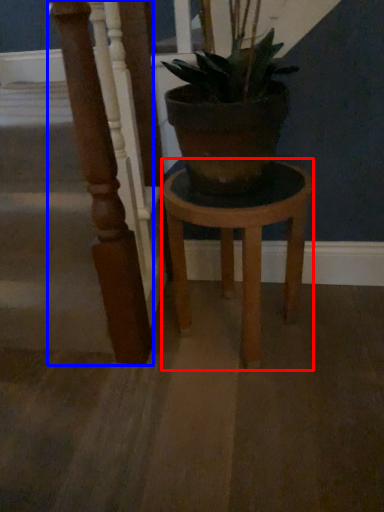
Question: Which point is closer to the camera, stool (highlighted by a red box) or pillar (highlighted by a blue box)?

Choices:
 (A) stool
 (B) pillar

Answer: (B)